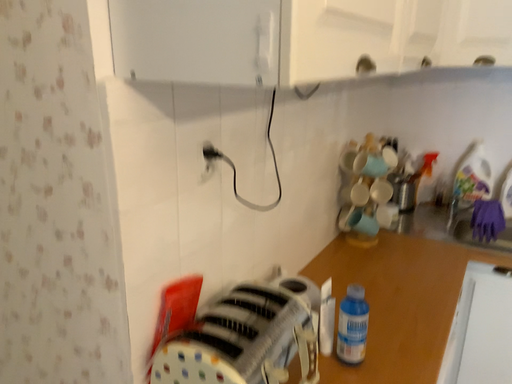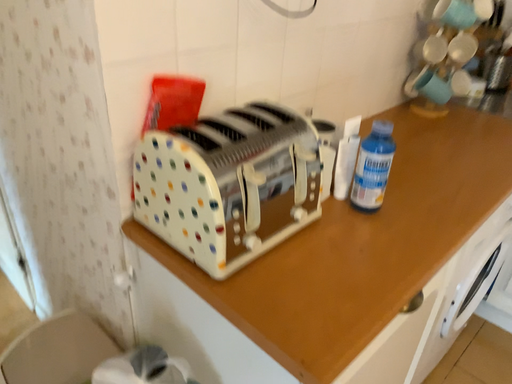
Question: How did the camera likely rotate when shooting the video?

Choices:
 (A) rotated upward
 (B) rotated downward

Answer: (B)